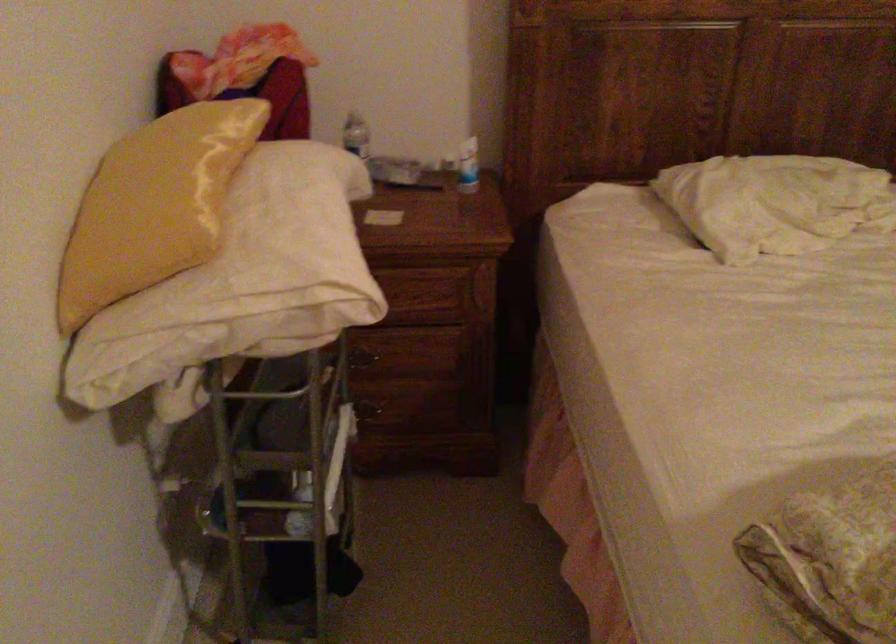
I want to click on plastic water bottle, so [x=356, y=136].